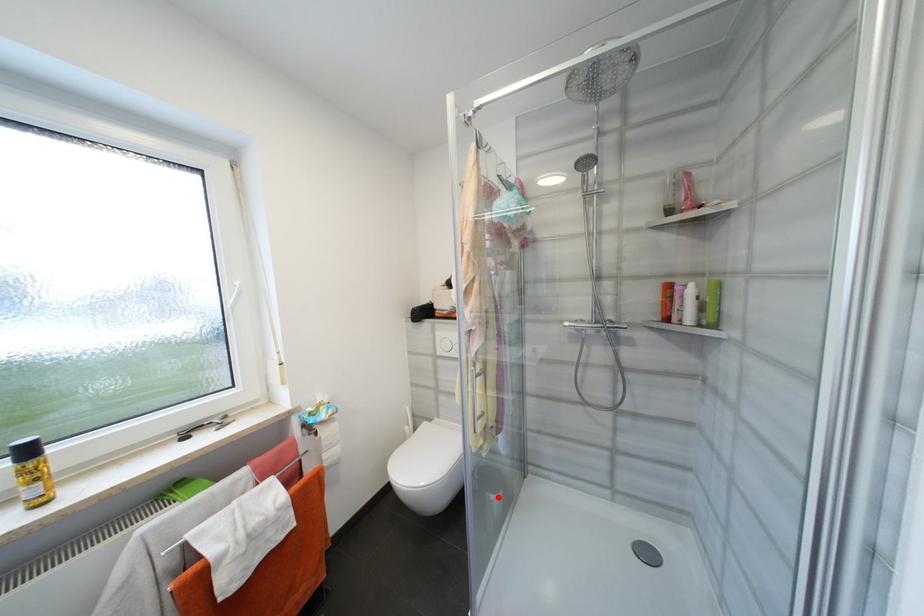
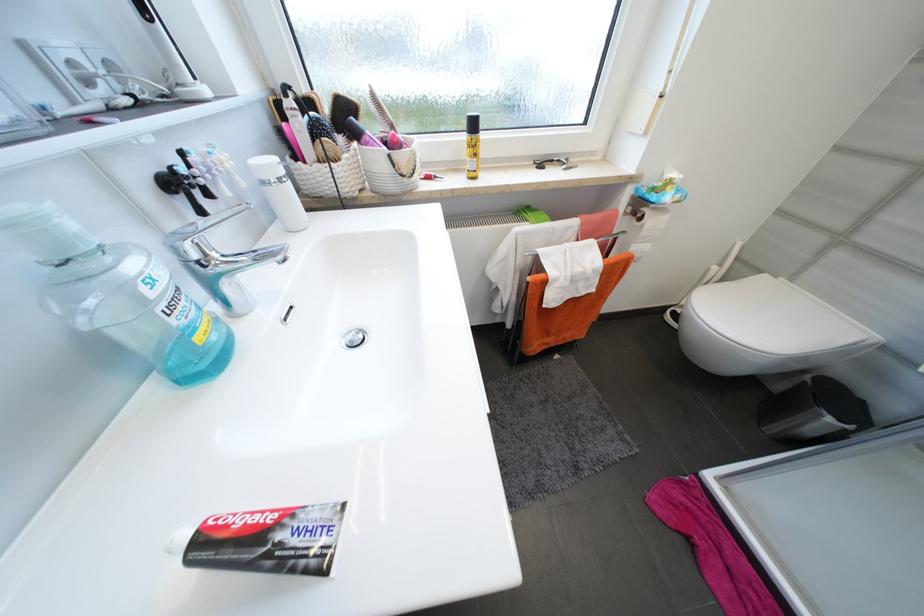
Question: I am providing you with two images of the same scene from different viewpoints. In image1, a red point is highlighted. Considering the same 3D point in image2, which of the following is correct?

Choices:
 (A) It is closer
 (B) It is farther

Answer: (A)